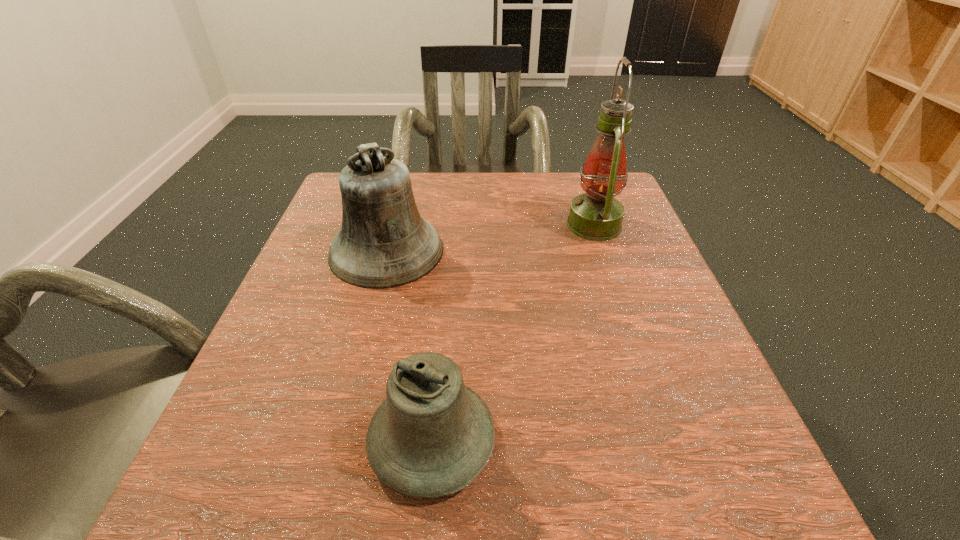
In the image, there is a desktop. Identify the location of free space at the far left corner. (339, 219).

In the image, there is a desktop. In order to click on vacant space at the near left corner in this screenshot , I will do 286,482.

At what (x,y) coordinates should I click in order to perform the action: click on free point between the nearest object and the taller bell. Please return your answer as a coordinate pair (x, y). The width and height of the screenshot is (960, 540). Looking at the image, I should click on (409, 346).

What are the coordinates of `vacant point located between the shortest object and the taller bell` in the screenshot? It's located at (409, 346).

Find the location of a particular element. Image resolution: width=960 pixels, height=540 pixels. vacant space in between the oil lamp and the nearest object is located at coordinates (513, 333).

You are a GUI agent. You are given a task and a screenshot of the screen. Output one action in this format:
    pyautogui.click(x=<x>, y=<y>)
    Task: Click on the empty location between the tallest object and the shortest object
    The height and width of the screenshot is (540, 960).
    Given the screenshot: What is the action you would take?
    pyautogui.click(x=513, y=333)

This screenshot has width=960, height=540. Identify the location of vacant area that lies between the tallest object and the farther bell. (491, 238).

Locate an element on the screen. Image resolution: width=960 pixels, height=540 pixels. vacant region between the tallest object and the shorter bell is located at coordinates (513, 333).

The height and width of the screenshot is (540, 960). Find the location of `vacant space that is in between the rightmost object and the second tallest object`. vacant space that is in between the rightmost object and the second tallest object is located at coordinates click(x=491, y=238).

What are the coordinates of `free point between the rightmost object and the nearer bell` in the screenshot? It's located at (513, 333).